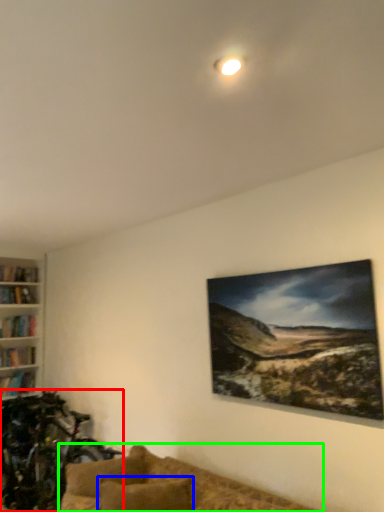
Question: Based on their relative distances, which object is farther from mountain bike (highlighted by a red box)? Choose from pillow (highlighted by a blue box) and studio couch (highlighted by a green box).

Choices:
 (A) pillow
 (B) studio couch

Answer: (A)